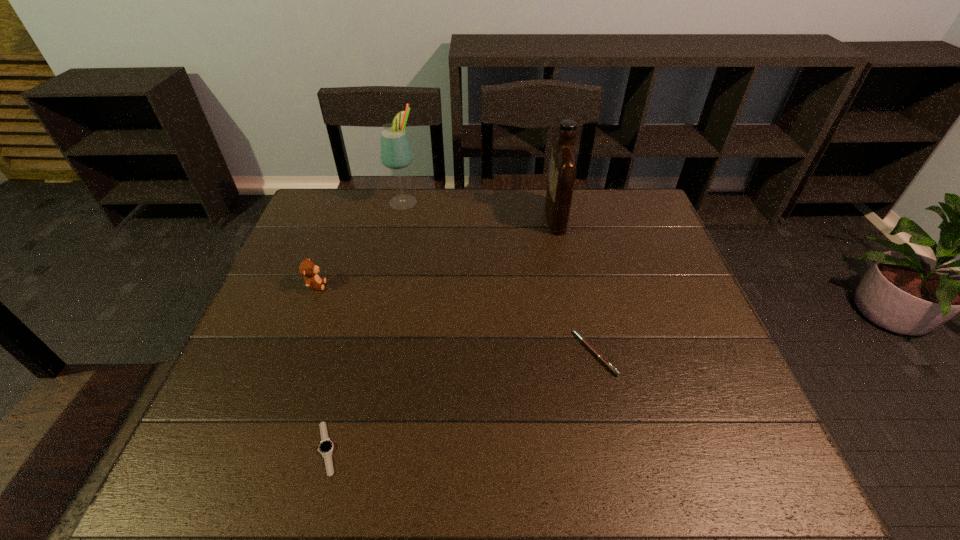
Locate an element on the screen. The image size is (960, 540). vacant space positioned 0.390m on the label side of the liquor is located at coordinates (424, 217).

Locate an element on the screen. The width and height of the screenshot is (960, 540). vacant space situated 0.100m on the label side of the liquor is located at coordinates (515, 217).

What are the coordinates of `free spot located 0.380m on the face of the teddy bear` in the screenshot? It's located at (467, 286).

You are a GUI agent. You are given a task and a screenshot of the screen. Output one action in this format:
    pyautogui.click(x=<x>, y=<y>)
    Task: Click on the blank area located at the nib of the fourth tallest object
    This screenshot has height=540, width=960.
    Given the screenshot: What is the action you would take?
    pyautogui.click(x=461, y=353)

The image size is (960, 540). I want to click on free space located at the nib of the fourth tallest object, so click(478, 353).

The width and height of the screenshot is (960, 540). I want to click on vacant space located at the nib of the fourth tallest object, so click(x=469, y=353).

I want to click on vacant area situated 0.130m on the left of the watch, so click(247, 448).

Identify the location of alcohol located in the far edge section of the desktop. The image size is (960, 540). (395, 151).

You are a GUI agent. You are given a task and a screenshot of the screen. Output one action in this format:
    pyautogui.click(x=<x>, y=<y>)
    Task: Click on the liquor that is positioned at the far edge
    This screenshot has height=540, width=960.
    Given the screenshot: What is the action you would take?
    pyautogui.click(x=563, y=166)

At what (x,y) coordinates should I click in order to perform the action: click on object that is at the near edge. Please return your answer as a coordinate pair (x, y). This screenshot has width=960, height=540. Looking at the image, I should click on (326, 446).